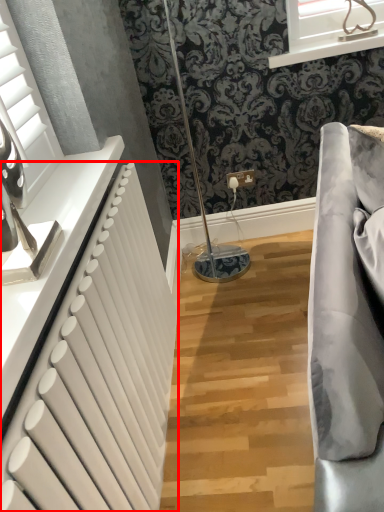
Question: From the image's perspective, what is the correct spatial positioning of radiator (annotated by the red box) in reference to window?

Choices:
 (A) above
 (B) below

Answer: (B)